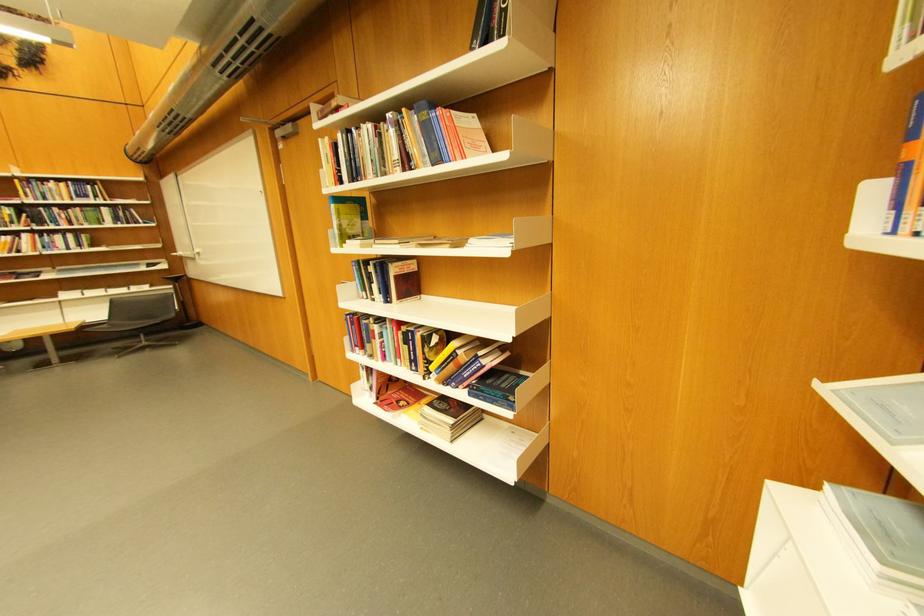
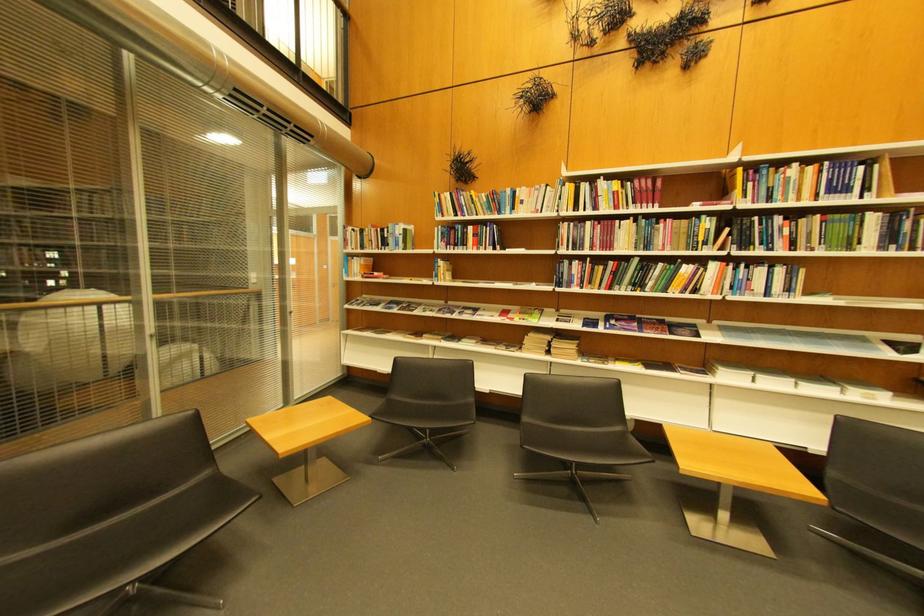
The point at (52, 225) is marked in the first image. Where is the corresponding point in the second image?

(756, 246)